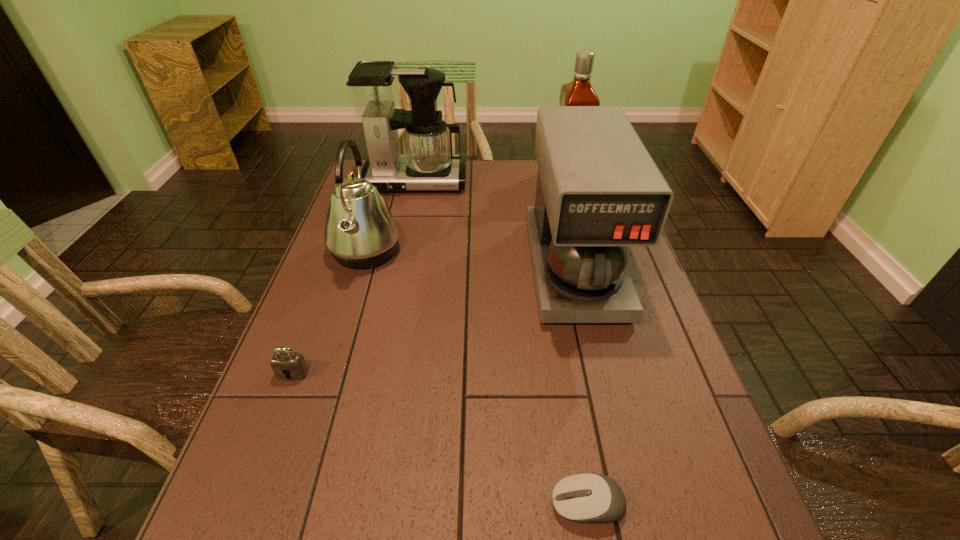
The height and width of the screenshot is (540, 960). Find the location of `liquor`. liquor is located at coordinates (579, 92).

Locate an element on the screen. This screenshot has width=960, height=540. the left coffee maker is located at coordinates (428, 164).

Where is `the nearer coffee maker`? the nearer coffee maker is located at coordinates (598, 191).

Where is `kettle`? kettle is located at coordinates (360, 231).

The width and height of the screenshot is (960, 540). Find the location of `the fifth farthest object`. the fifth farthest object is located at coordinates (287, 365).

The width and height of the screenshot is (960, 540). I want to click on the second shortest object, so click(287, 365).

I want to click on the shortest object, so click(x=586, y=497).

This screenshot has width=960, height=540. I want to click on computer equipment, so click(x=586, y=497).

Find the location of a particular element. The image size is (960, 540). blank space located on the front label of the liquor is located at coordinates (520, 179).

This screenshot has height=540, width=960. Identify the location of free space located 0.160m on the front label of the liquor. (505, 179).